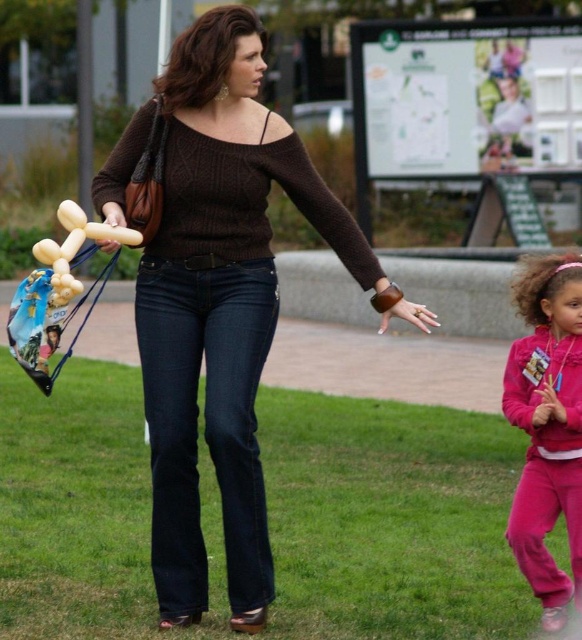
You are a photographer trying to capture both the golden balloon animal at left and the translucent yellow balloon animal at left in a single frame. Based on their sizes, which balloon animal will appear larger in your photo?

The golden balloon animal at left will appear larger in the photo because its width surpasses that of the translucent yellow balloon animal at left.

You are standing in the grassy area and want to walk from point A to point B. Point A is at coordinates point (19, 568) and point B is at coordinates point (168, 104). Which point is closer to you?

Point A is closer to you because it is further to the viewer than point B.

You are a photographer trying to capture a photo of the golden balloon animal at left and the pink fleece pants at right. Based on their heights, which object should you focus on first if you want to ensure both are in frame without adjusting your camera angle?

The pink fleece pants at right is taller than the golden balloon animal at left, so you should focus on the pink fleece pants at right first to ensure both are in frame.